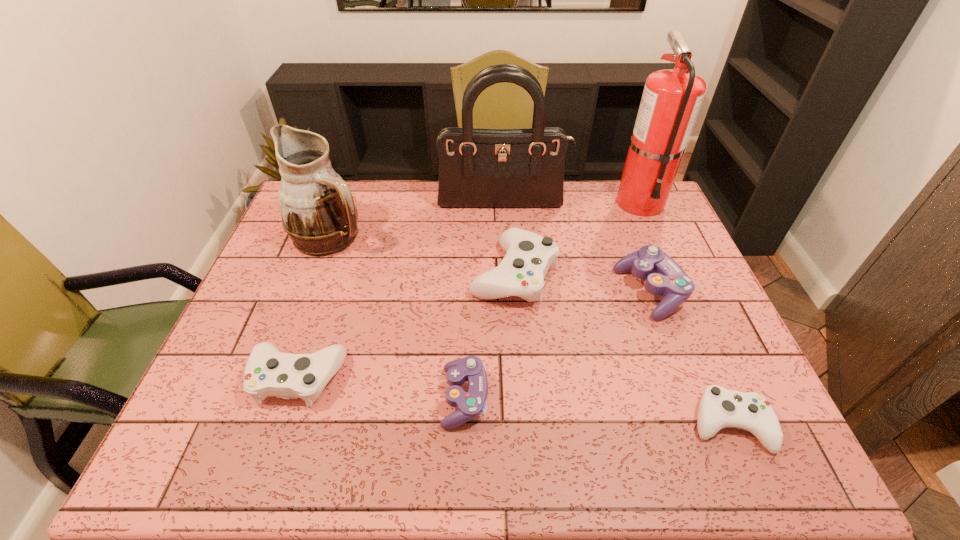
Locate an element on the screen. Image resolution: width=960 pixels, height=540 pixels. blank space located on the back of the smaller purple control is located at coordinates (468, 276).

Locate an element on the screen. The height and width of the screenshot is (540, 960). free space located on the left of the smallest white control is located at coordinates (655, 423).

You are a GUI agent. You are given a task and a screenshot of the screen. Output one action in this format:
    pyautogui.click(x=<x>, y=<y>)
    Task: Click on the fire extinguisher located in the far edge section of the desktop
    
    Given the screenshot: What is the action you would take?
    pyautogui.click(x=671, y=98)

At what (x,y) coordinates should I click in order to perform the action: click on handbag at the far edge. Please return your answer as a coordinate pair (x, y). This screenshot has width=960, height=540. Looking at the image, I should click on (478, 168).

Identify the location of pitcher at the far edge. (318, 212).

You are a GUI agent. You are given a task and a screenshot of the screen. Output one action in this format:
    pyautogui.click(x=<x>, y=<y>)
    Task: Click on the pitcher situated at the left edge
    
    Given the screenshot: What is the action you would take?
    point(318,212)

What are the coordinates of `control positioned at the left edge` in the screenshot? It's located at (268, 372).

Where is `fire extinguisher that is positioned at the right edge`? The width and height of the screenshot is (960, 540). fire extinguisher that is positioned at the right edge is located at coordinates (671, 98).

You are a GUI agent. You are given a task and a screenshot of the screen. Output one action in this format:
    pyautogui.click(x=<x>, y=<y>)
    Task: Click on the object present at the far left corner
    
    Given the screenshot: What is the action you would take?
    pyautogui.click(x=318, y=212)

Where is `object positioned at the far right corner`? object positioned at the far right corner is located at coordinates 671,98.